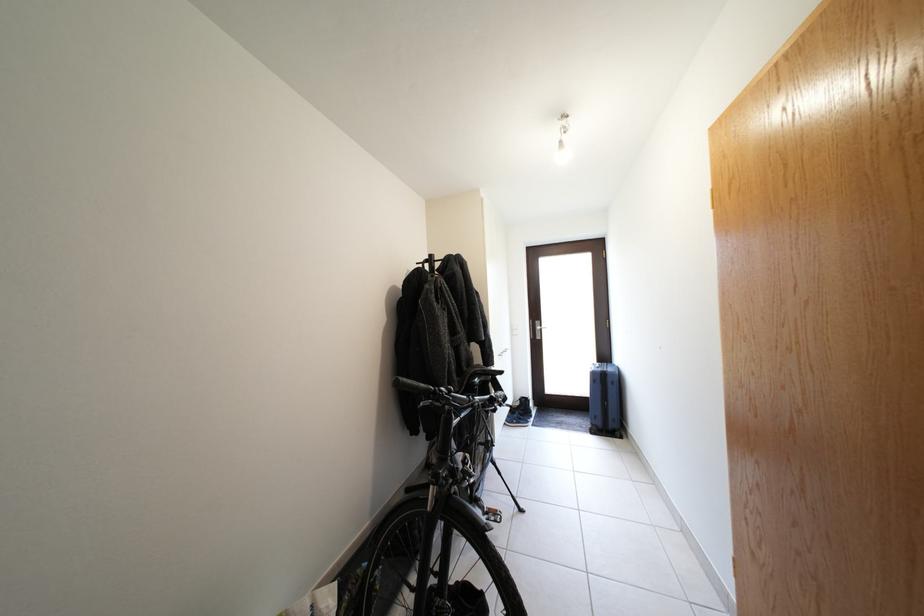
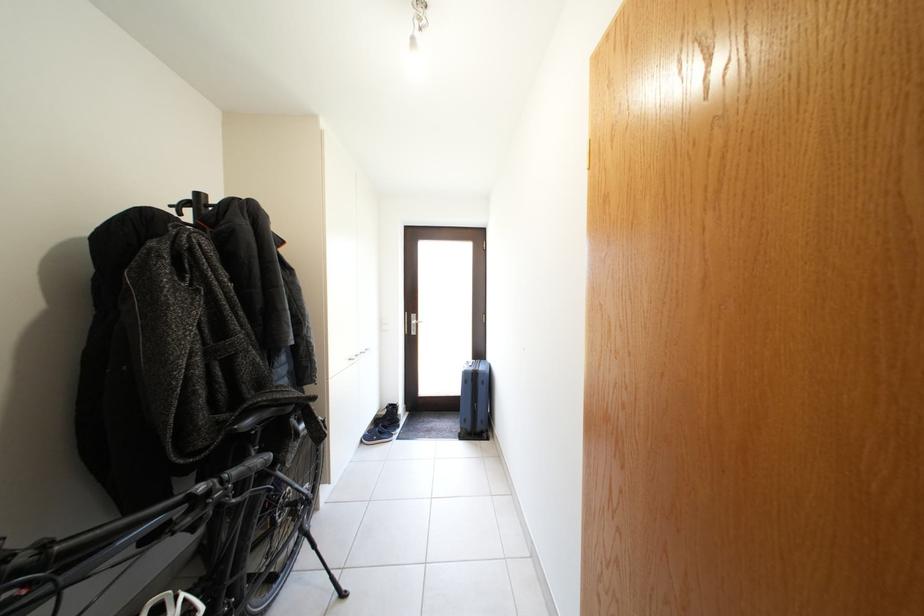
In the second image, find the point that corresponds to the point at 440,261 in the first image.

(205, 200)